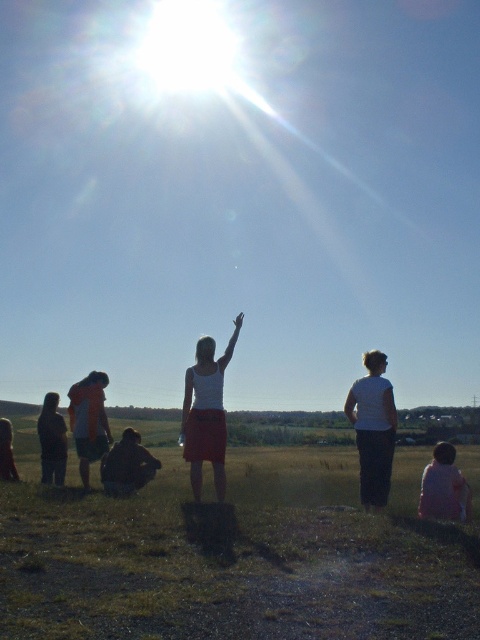
Where is `green grass at center`? green grass at center is located at coordinates (232, 554).

Which is in front, point (284, 602) or point (432, 476)?

Point (284, 602)

Between point (176, 620) and point (448, 445), which one is positioned in front?

Point (176, 620) is more forward.

At what (x,y) coordinates should I click in order to perform the action: click on green grass at center. Please return your answer as a coordinate pair (x, y). The width and height of the screenshot is (480, 640). Looking at the image, I should click on (232, 554).

Looking at this image, is white matte shirt at center closer to camera compared to dark brown fabric at lower left?

Yes, white matte shirt at center is in front of dark brown fabric at lower left.

Who is more forward, (349, 400) or (105, 474)?

Point (349, 400)

Where is `white matte shirt at center`? The height and width of the screenshot is (640, 480). white matte shirt at center is located at coordinates (372, 428).

Does green grass at center appear under matte black jacket at lower left?

Yes, green grass at center is below matte black jacket at lower left.

Locate an element on the screen. This screenshot has height=640, width=480. green grass at center is located at coordinates point(232,554).